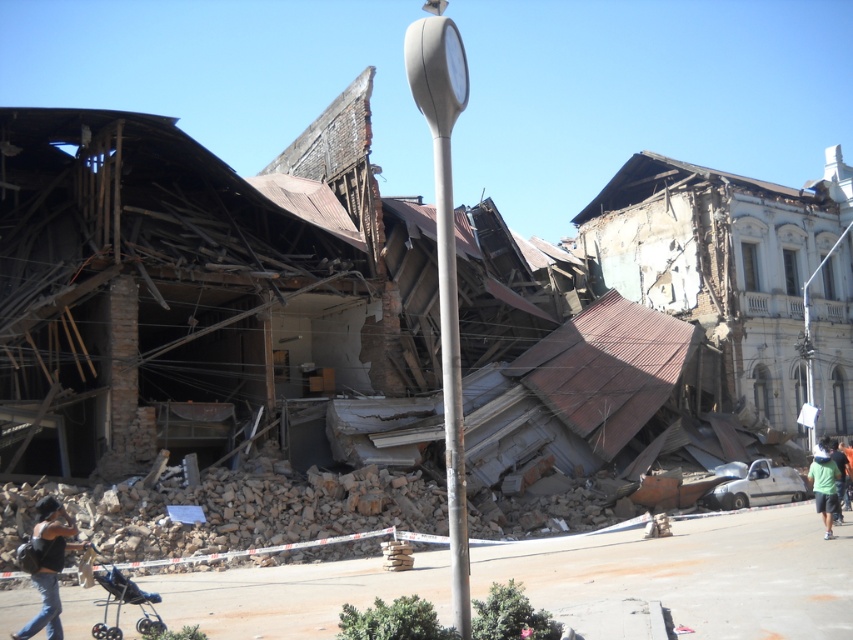
You are a rescue worker trying to reach the green fabric shirt at lower right to check for survivors. The metallic gray pole at center is blocking your path. Can you walk around it to reach the shirt without going too far off the path?

The metallic gray pole at center is closer to the viewer than the green fabric shirt at lower right, so you can walk around the pole to reach the shirt without deviating too far from your path.

You are a rescue worker trying to navigate through the damaged area. You see a dark gray fabric backpack at lower left. Based on its position, can you estimate how far it is from the lamppost in the center?

The dark gray fabric backpack at lower left is located at point (x=49, y=564). Since the lamppost is at the center, the backpack is relatively close to the lamppost but slightly to the lower left side.

You are a rescue worker surveying the disaster area. You see the metallic gray pole at center and the dark gray fabric backpack at lower left. Which object is higher in elevation?

The metallic gray pole at center is above the dark gray fabric backpack at lower left, so it is higher in elevation.